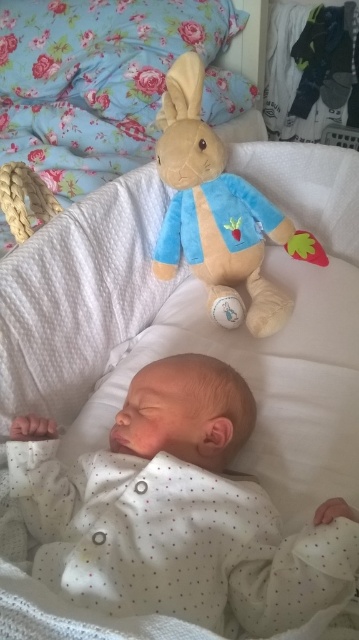
Question: Is the position of white dotted fabric at center less distant than that of soft plush rabbit at upper center?

Choices:
 (A) no
 (B) yes

Answer: (B)

Question: Among these points, which one is nearest to the camera?

Choices:
 (A) (199, 81)
 (B) (268, 497)

Answer: (B)

Question: Can you confirm if white dotted fabric at center is bigger than soft plush rabbit at upper center?

Choices:
 (A) yes
 (B) no

Answer: (B)

Question: Which object appears closest to the camera in this image?

Choices:
 (A) soft plush rabbit at upper center
 (B) white dotted fabric at center

Answer: (B)

Question: Does white dotted fabric at center have a larger size compared to soft plush rabbit at upper center?

Choices:
 (A) no
 (B) yes

Answer: (A)